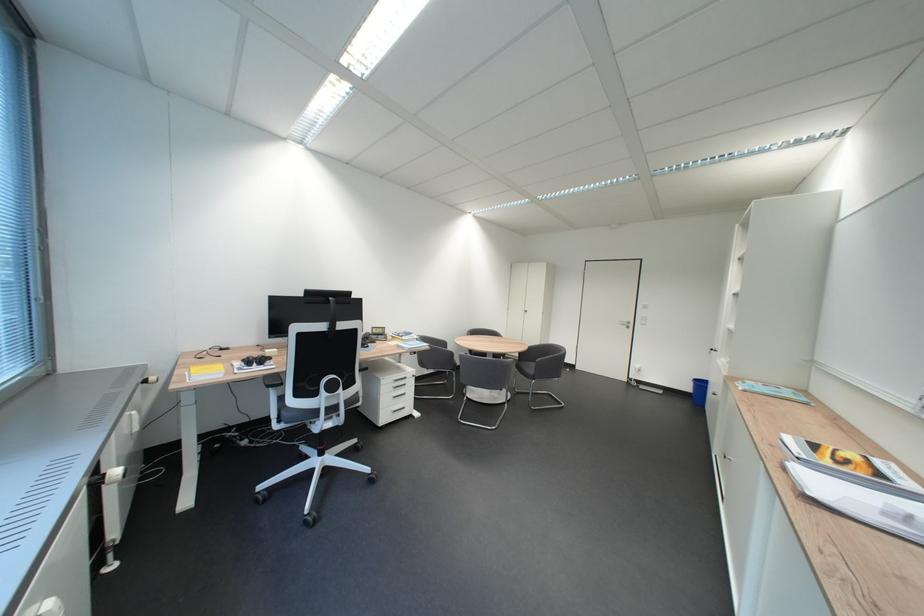
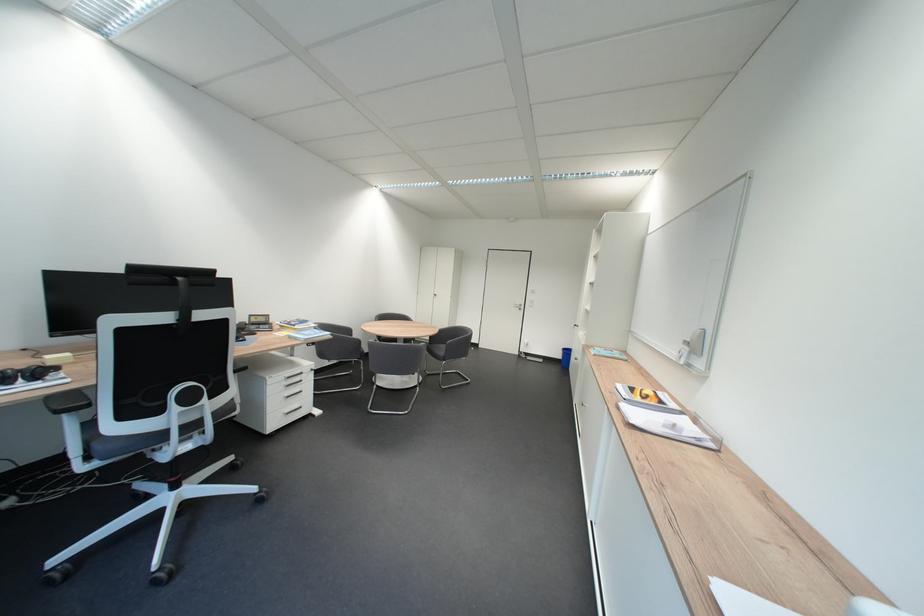
The point at (809, 469) is marked in the first image. Where is the corresponding point in the second image?

(637, 408)